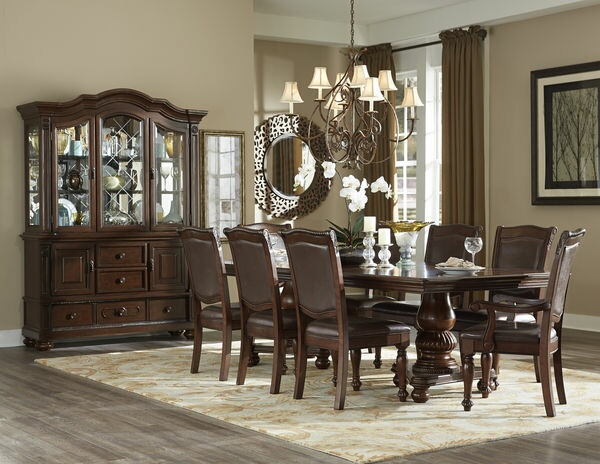
The height and width of the screenshot is (464, 600). I want to click on chair, so click(211, 268), click(260, 279), click(308, 285), click(523, 244), click(564, 258), click(445, 243), click(271, 227), click(394, 251).